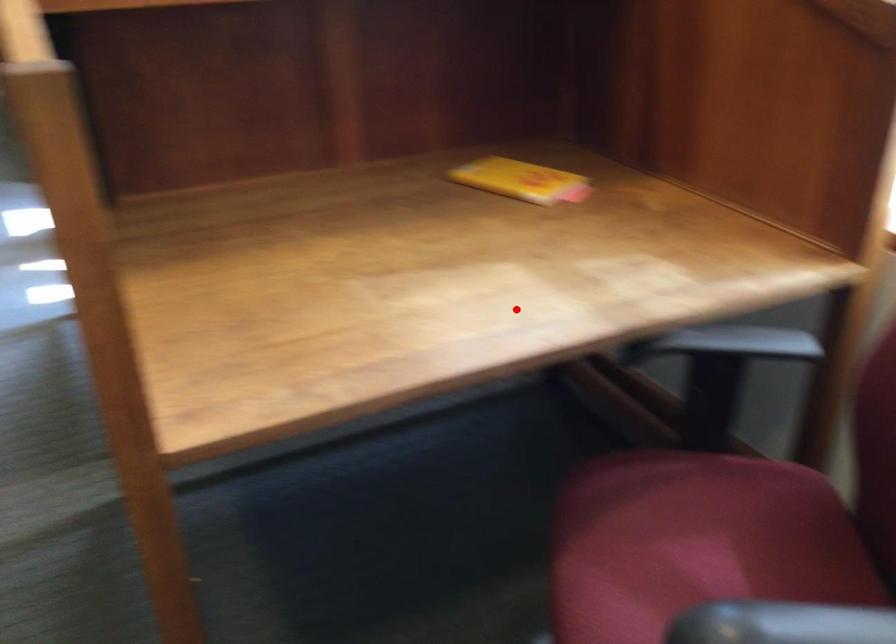
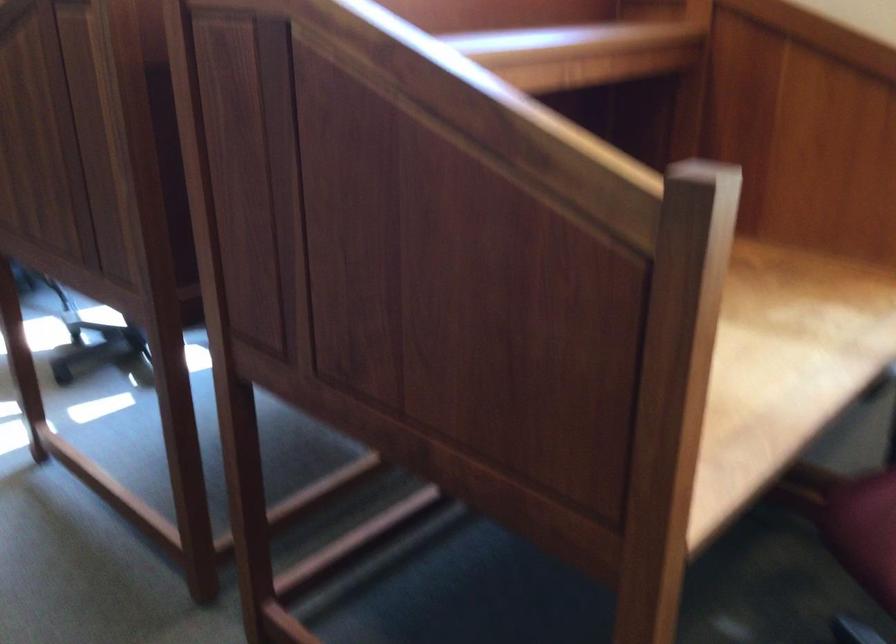
In the second image, find the point that corresponds to the highlighted location in the first image.

(778, 360)